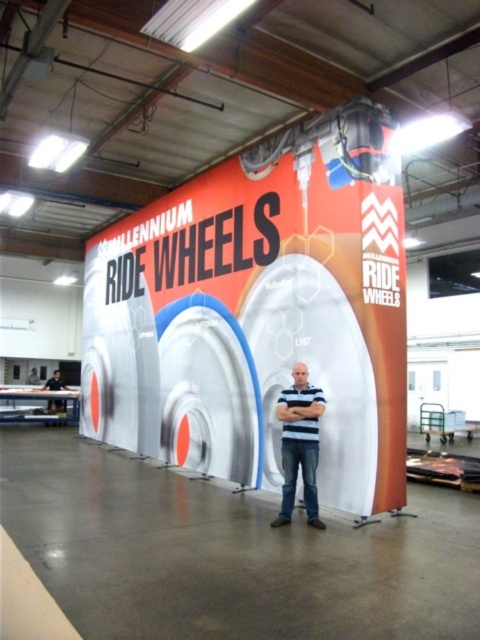
Question: Does white glossy sign at center have a greater width compared to striped cotton shirt at center?

Choices:
 (A) no
 (B) yes

Answer: (B)

Question: Which object appears farthest from the camera in this image?

Choices:
 (A) white glossy sign at center
 (B) striped cotton shirt at center

Answer: (A)

Question: Among these objects, which one is nearest to the camera?

Choices:
 (A) blue striped shirt at center
 (B) striped cotton shirt at center

Answer: (B)

Question: Considering the relative positions of white glossy sign at center and blue striped shirt at center in the image provided, where is white glossy sign at center located with respect to blue striped shirt at center?

Choices:
 (A) below
 (B) above

Answer: (B)

Question: Does white glossy sign at center appear over blue striped shirt at center?

Choices:
 (A) no
 (B) yes

Answer: (B)

Question: Based on their relative distances, which object is nearer to the blue striped shirt at center?

Choices:
 (A) striped cotton shirt at center
 (B) white glossy sign at center

Answer: (A)